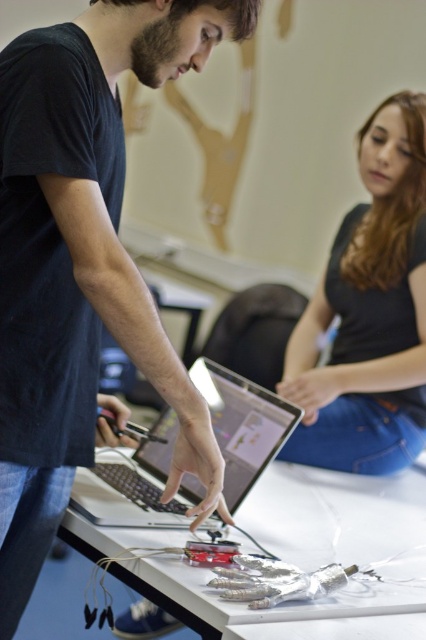
You are setting up a presentation and need to place both the white plastic table at center and the silver metallic laptop at center on a stage. The stage has limited space. Which object should you place first to ensure both fit properly?

→ You should place the white plastic table at center first because it is bigger than the silver metallic laptop at center, so positioning it first ensures there is enough space left for the laptop.

Based on the photo, you are a person who is 1.7 meters tall. You are standing in front of the white plastic table at center. Can you comfortably place your hands on the table surface without bending over?

The white plastic table at center is 1.12 meters away from the viewer. Since the average table height for a person of 1.7 meters is typically around 0.76 meters, the table is at a comfortable working distance. Therefore, you can comfortably place your hands on the table surface without bending over.